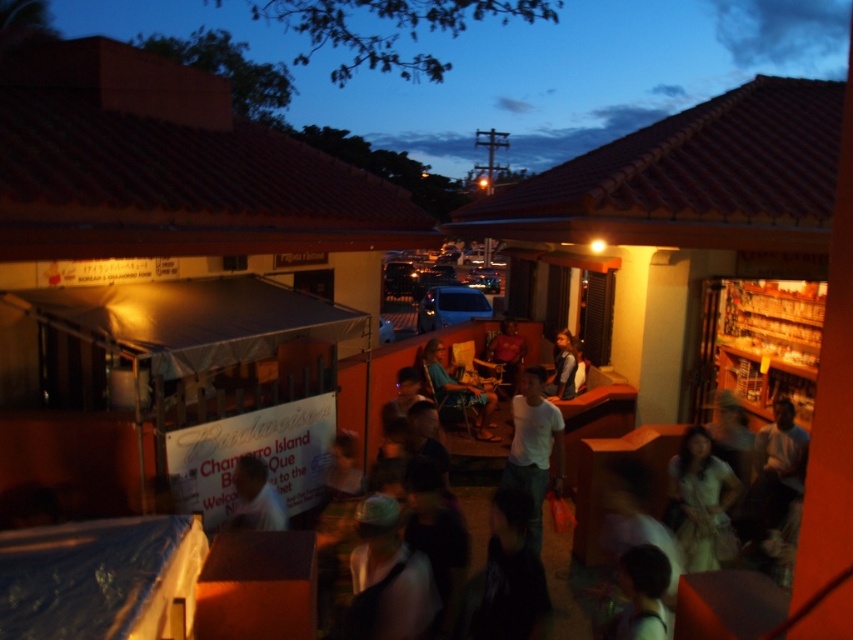
Question: Does matte white signboard at center have a smaller size compared to blue fabric chair at center?

Choices:
 (A) yes
 (B) no

Answer: (A)

Question: Observing the image, what is the correct spatial positioning of matte white signboard at center in reference to blue fabric chair at center?

Choices:
 (A) left
 (B) right

Answer: (A)

Question: Which object is positioned farthest from the white fabric dress at lower right?

Choices:
 (A) blue fabric chair at center
 (B) matte white signboard at center
 (C) white cotton shirt at center

Answer: (A)

Question: Which point is closer to the camera?

Choices:
 (A) white fabric dress at lower right
 (B) blue fabric chair at center
 (C) matte white signboard at center

Answer: (C)

Question: Which of the following is the farthest from the observer?

Choices:
 (A) matte white signboard at center
 (B) white fabric dress at lower right

Answer: (B)

Question: Can you confirm if white cotton shirt at center is positioned below blue fabric chair at center?

Choices:
 (A) no
 (B) yes

Answer: (B)